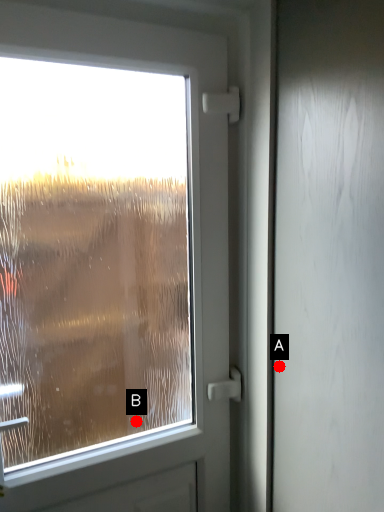
Question: Two points are circled on the image, labeled by A and B beside each circle. Among these points, which one is nearest to the camera?

Choices:
 (A) A is closer
 (B) B is closer

Answer: (A)